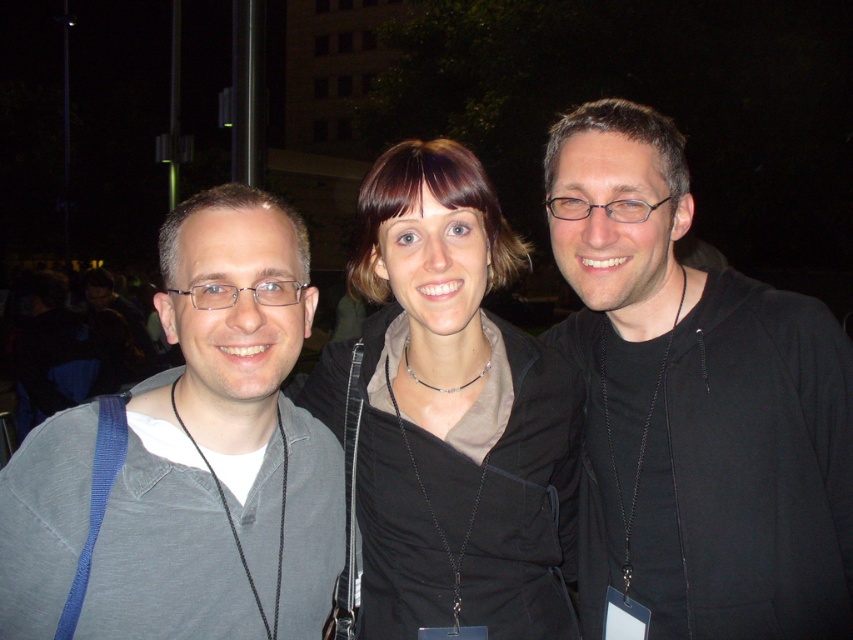
Question: Among these points, which one is nearest to the camera?

Choices:
 (A) (236, 486)
 (B) (505, 445)
 (C) (792, 563)

Answer: (A)

Question: Does black matte jacket at right appear on the left side of gray cotton shirt at left?

Choices:
 (A) yes
 (B) no

Answer: (B)

Question: Which point appears closest to the camera in this image?

Choices:
 (A) (402, 630)
 (B) (125, 624)
 (C) (596, 307)

Answer: (B)

Question: Which object appears closest to the camera in this image?

Choices:
 (A) gray cotton shirt at left
 (B) black matte jacket at center

Answer: (A)

Question: Does black matte jacket at right have a larger size compared to gray cotton shirt at left?

Choices:
 (A) yes
 (B) no

Answer: (A)

Question: Is gray cotton shirt at left below black matte jacket at center?

Choices:
 (A) no
 (B) yes

Answer: (B)